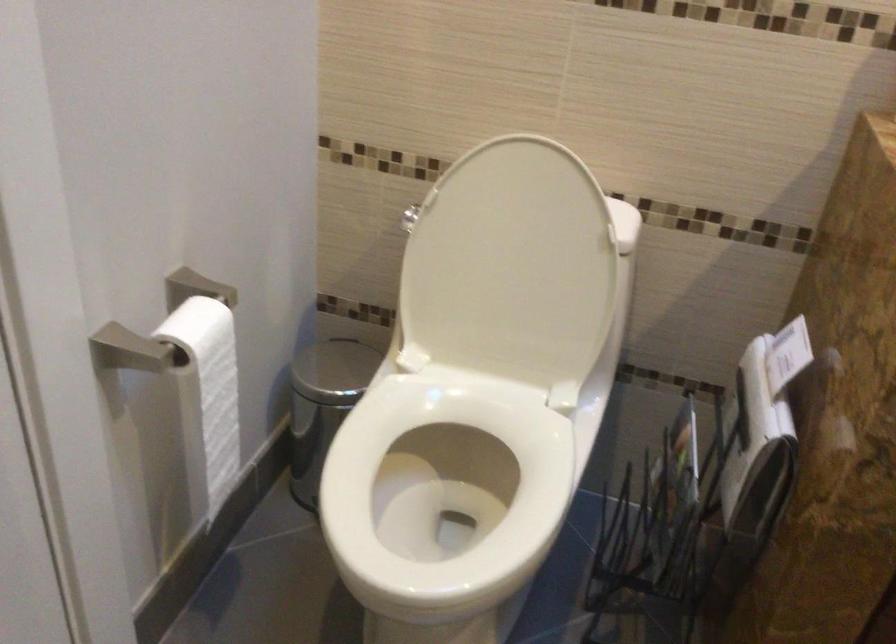
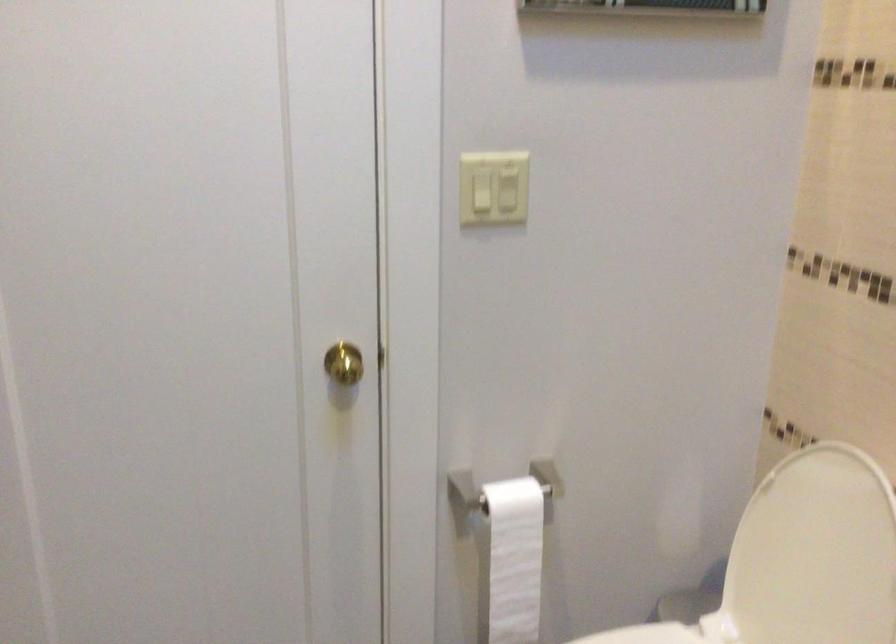
Where in the second image is the point corresponding to [216,402] from the first image?

(513, 560)